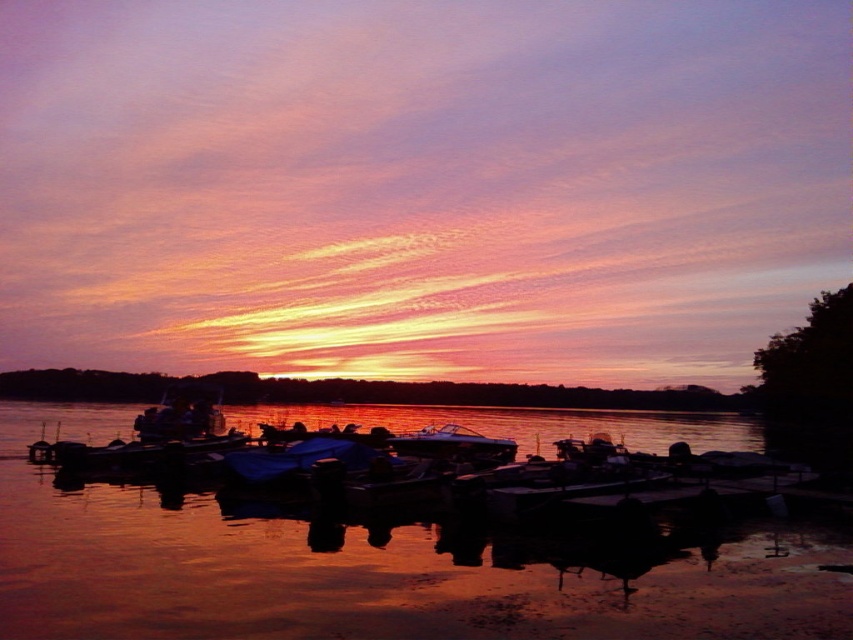
You are a photographer standing at the lakeside. You want to capture a photo of the glossy white boat at center from the glossy water at center. Given that your camera can focus up to 150 feet, will you be able to take a clear photo of the boat?

The distance between the glossy water at center and the glossy white boat at center is 152.43 feet, which exceeds the camera focus limit of 150 feet. Therefore, the boat will not be in focus and the photo will not be clear.

You are a photographer trying to capture the sunset reflection on the water. You have a camera with a wide angle lens that can capture large scenes. Which object between the glossy water at center and the glossy white boat at center would allow you to capture more of the sunset reflection?

The glossy water at center has a larger size compared to the glossy white boat at center, so it would allow you to capture more of the sunset reflection.

Based on the photo, you are standing at the lakeside and want to take a photo of the glossy white boat at center. To ensure the reflection of the sunset in the glossy water at center is visible in the photo, where should you position yourself relative to the boat?

You should position yourself to the left of the glossy white boat at center so that the glossy water at center, which is on the left side of the boat, is included in the frame to capture the sunset reflection.